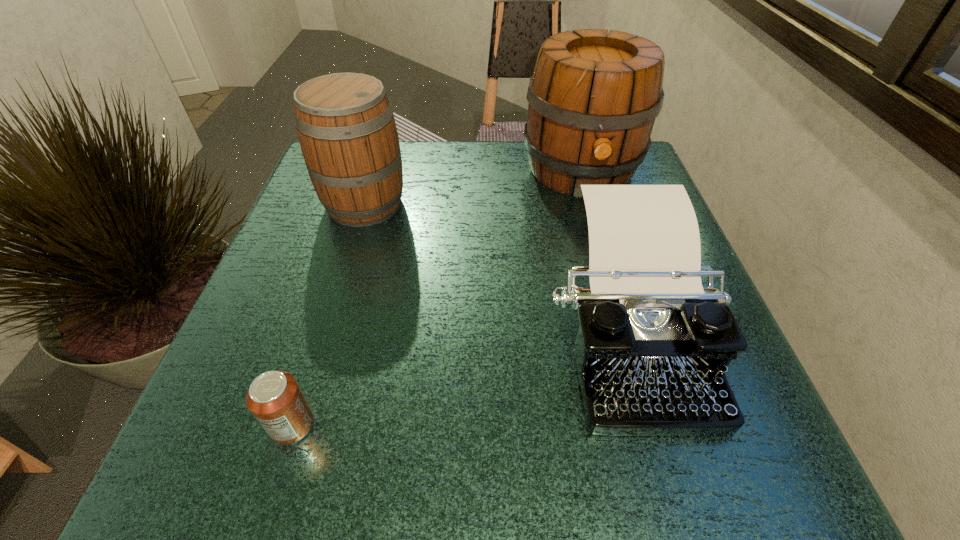
You are a GUI agent. You are given a task and a screenshot of the screen. Output one action in this format:
    pyautogui.click(x=<x>, y=<y>)
    Task: Click on the right cider
    
    Given the screenshot: What is the action you would take?
    pyautogui.click(x=593, y=98)

Identify the location of the left cider. This screenshot has height=540, width=960. (345, 123).

Locate an element on the screen. This screenshot has width=960, height=540. typewriter is located at coordinates (652, 348).

The height and width of the screenshot is (540, 960). I want to click on can, so click(275, 399).

At what (x,y) coordinates should I click in order to perform the action: click on free spot located 0.310m on the side of the right cider where the spigot is located. Please return your answer as a coordinate pair (x, y). Looking at the image, I should click on (625, 326).

Find the location of a particular element. This screenshot has width=960, height=540. free space located on the front of the left cider is located at coordinates (341, 282).

This screenshot has height=540, width=960. Identify the location of blank area located 0.070m on the keys of the typewriter. (673, 492).

At what (x,y) coordinates should I click in order to perform the action: click on vacant space situated on the back of the shortest object. Please return your answer as a coordinate pair (x, y). The height and width of the screenshot is (540, 960). Looking at the image, I should click on (355, 224).

The width and height of the screenshot is (960, 540). Find the location of `typewriter at the near edge`. typewriter at the near edge is located at coordinates (652, 348).

The image size is (960, 540). What are the coordinates of `can that is at the near edge` in the screenshot? It's located at (275, 399).